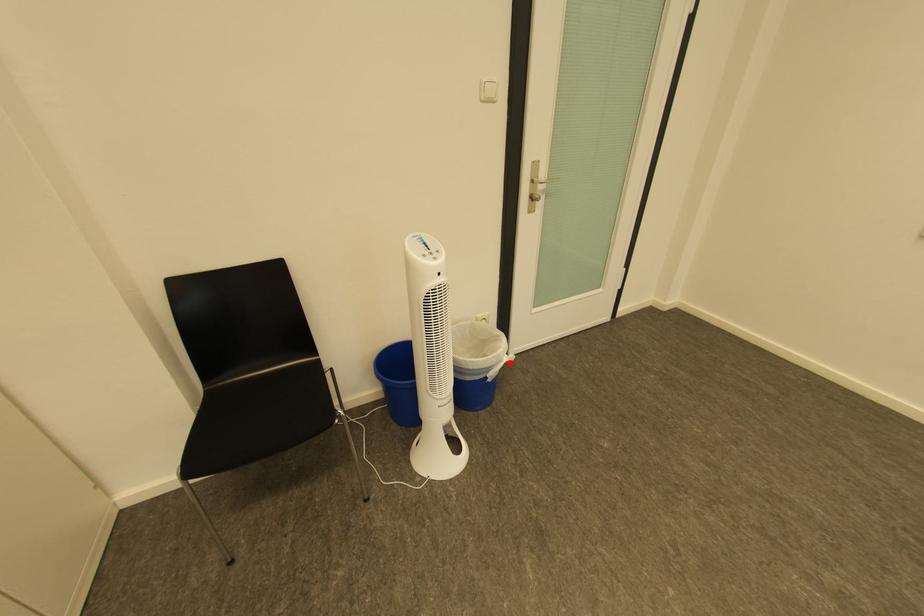
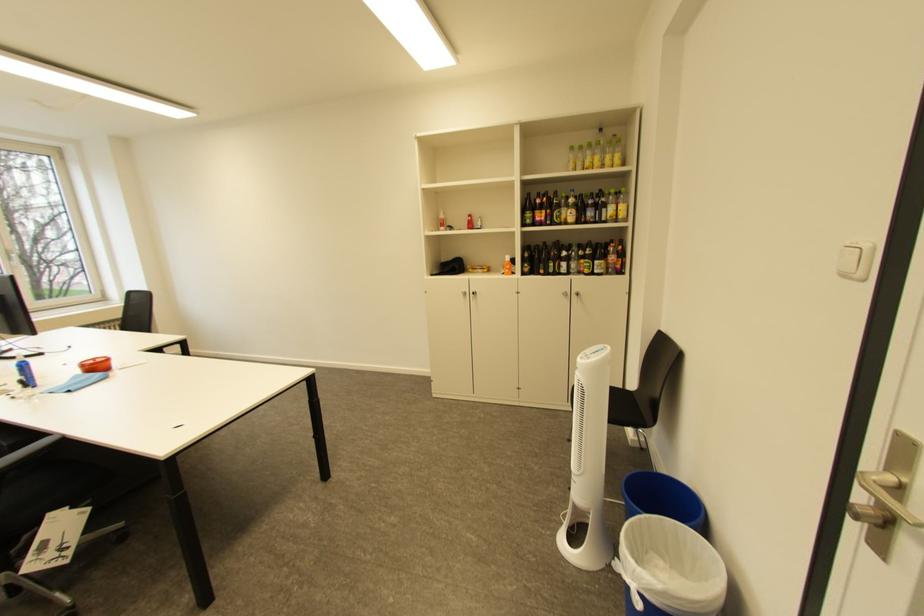
In the second image, find the point that corresponds to the highlighted location in the first image.

(636, 570)